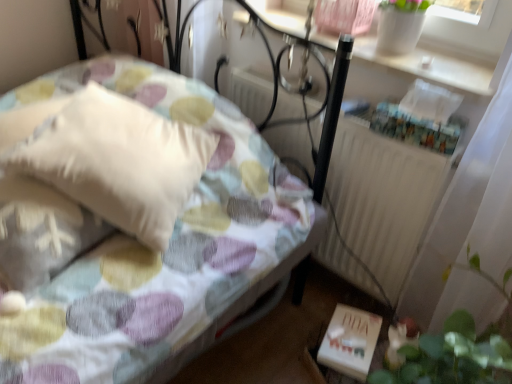
At what (x,y) coordinates should I click in order to perform the action: click on white textured radiator at center. Please return your answer as a coordinate pair (x, y). Looking at the image, I should click on (384, 198).

The width and height of the screenshot is (512, 384). Identify the location of green leafy plant at lower right. (448, 356).

Is fluffy white pillow at upper left smaller than white soft pillow at left?

No, fluffy white pillow at upper left is not smaller than white soft pillow at left.

From a real-world perspective, does fluffy white pillow at upper left stand above white soft pillow at left?

Incorrect, from a real-world perspective, fluffy white pillow at upper left is lower than white soft pillow at left.

Is fluffy white pillow at upper left taller or shorter than white soft pillow at left?

Clearly, fluffy white pillow at upper left is taller compared to white soft pillow at left.

Are fluffy white pillow at upper left and white soft pillow at left far apart?

fluffy white pillow at upper left is near white soft pillow at left, not far away.

The image size is (512, 384). What are the coordinates of `window sill above the white soft pillow at left (from the image's perspective)` in the screenshot? It's located at (431, 68).

Considering the sizes of objects white ceramic vase at upper right and white soft pillow at left in the image provided, who is taller, white ceramic vase at upper right or white soft pillow at left?

white soft pillow at left.

Which of these two, white ceramic vase at upper right or white soft pillow at left, is bigger?

With larger size is white soft pillow at left.

Is white ceramic vase at upper right oriented towards white soft pillow at left?

No, white ceramic vase at upper right is not turned towards white soft pillow at left.

Is the depth of white ceramic vase at upper right greater than that of white textured radiator at center?

No, white ceramic vase at upper right is in front of white textured radiator at center.

Where is `radiator that is behind the white ceramic vase at upper right`? This screenshot has height=384, width=512. radiator that is behind the white ceramic vase at upper right is located at coordinates (384, 198).

Is white ceramic vase at upper right at the right side of white textured radiator at center?

Yes.

Is point (275, 22) closer to camera compared to point (392, 264)?

No, it is behind (392, 264).

Is white textured radiator at center turned away from green leafy plant at lower right?

That's not correct — white textured radiator at center is not looking away from green leafy plant at lower right.

Looking at this image, between white textured radiator at center and green leafy plant at lower right, which one has smaller size?

Smaller between the two is white textured radiator at center.

Where is `plant to the right of white textured radiator at center`? The image size is (512, 384). plant to the right of white textured radiator at center is located at coordinates (448, 356).

Is white textured radiator at center taller than green leafy plant at lower right?

No.

Does fluffy white pillow at upper left have a greater width compared to white textured radiator at center?

Correct, the width of fluffy white pillow at upper left exceeds that of white textured radiator at center.

Can you confirm if fluffy white pillow at upper left is smaller than white textured radiator at center?

Actually, fluffy white pillow at upper left might be larger than white textured radiator at center.

Can we say fluffy white pillow at upper left lies outside white textured radiator at center?

Yes, fluffy white pillow at upper left is not within white textured radiator at center.

What are the coordinates of `window sill in front of the white textured radiator at center` in the screenshot? It's located at (431, 68).

Is the position of white textured radiator at center more distant than that of white ceramic vase at upper right?

Yes, white textured radiator at center is further from the camera.

Can you confirm if white textured radiator at center is bigger than white ceramic vase at upper right?

Yes, white textured radiator at center is bigger than white ceramic vase at upper right.

Considering the sizes of objects white textured radiator at center and white ceramic vase at upper right in the image provided, who is shorter, white textured radiator at center or white ceramic vase at upper right?

white ceramic vase at upper right is shorter.

Considering the sizes of objects white ceramic vase at upper right and white matte book at lower right in the image provided, who is wider, white ceramic vase at upper right or white matte book at lower right?

Wider between the two is white ceramic vase at upper right.

Considering the positions of objects white ceramic vase at upper right and white matte book at lower right in the image provided, who is in front, white ceramic vase at upper right or white matte book at lower right?

white ceramic vase at upper right is more forward.

Considering the positions of points (471, 89) and (379, 317), is point (471, 89) closer to camera compared to point (379, 317)?

Yes.

Is white ceramic vase at upper right to the left or to the right of white matte book at lower right in the image?

From the image, it's evident that white ceramic vase at upper right is to the right of white matte book at lower right.

Where is `pillow above the fluffy white pillow at upper left (from a real-world perspective)`? pillow above the fluffy white pillow at upper left (from a real-world perspective) is located at coordinates (109, 158).

Identify the location of window sill behind the white soft pillow at left. Image resolution: width=512 pixels, height=384 pixels. (431, 68).

Based on their spatial positions, is fluffy white pillow at upper left or white ceramic vase at upper right further from white soft pillow at left?

white ceramic vase at upper right is further to white soft pillow at left.

When comparing their distances from white textured radiator at center, does green leafy plant at lower right or white ceramic vase at upper right seem further?

The object further to white textured radiator at center is green leafy plant at lower right.

Looking at the image, which one is located further to white ceramic vase at upper right, white textured radiator at center or white matte book at lower right?

Based on the image, white matte book at lower right appears to be further to white ceramic vase at upper right.

Considering their positions, is white ceramic vase at upper right positioned closer to green leafy plant at lower right than white soft pillow at left?

The object closer to green leafy plant at lower right is white ceramic vase at upper right.

Based on their spatial positions, is white soft pillow at left or white textured radiator at center closer to green leafy plant at lower right?

The object closer to green leafy plant at lower right is white textured radiator at center.

Which object lies nearer to the anchor point white soft pillow at left, green leafy plant at lower right or white textured radiator at center?

white textured radiator at center is positioned closer to the anchor white soft pillow at left.

When comparing their distances from white ceramic vase at upper right, does green leafy plant at lower right or white matte book at lower right seem closer?

Among the two, green leafy plant at lower right is located nearer to white ceramic vase at upper right.

From the image, which object appears to be farther from white textured radiator at center, white soft pillow at left or white ceramic vase at upper right?

white soft pillow at left lies further to white textured radiator at center than the other object.

Find the location of a particular element. pillow between white ceramic vase at upper right and white matte book at lower right in the vertical direction is located at coordinates (109, 158).

The width and height of the screenshot is (512, 384). Find the location of `pillow between fluffy white pillow at upper left and green leafy plant at lower right in the horizontal direction`. pillow between fluffy white pillow at upper left and green leafy plant at lower right in the horizontal direction is located at coordinates (109, 158).

Locate an element on the screen. book between white soft pillow at left and green leafy plant at lower right in the horizontal direction is located at coordinates (350, 341).

The width and height of the screenshot is (512, 384). Identify the location of radiator between fluffy white pillow at upper left and white ceramic vase at upper right from left to right. (384, 198).